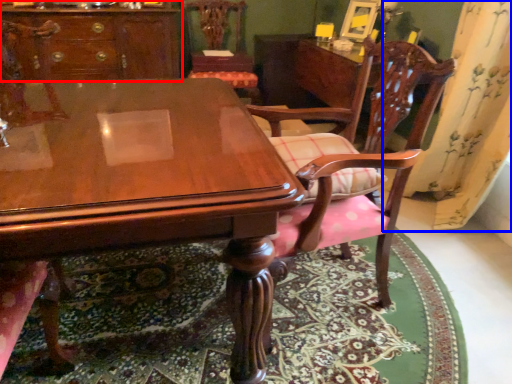
Question: Which of the following is the farthest to the observer, cabinetry (highlighted by a red box) or curtain (highlighted by a blue box)?

Choices:
 (A) cabinetry
 (B) curtain

Answer: (A)